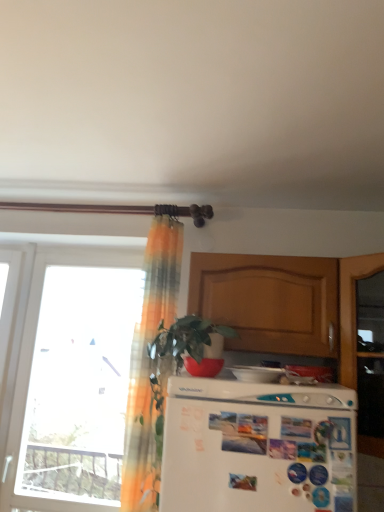
Question: Is white glossy refrigerator at center, which is the 1th appliance in left-to-right order, behind white glossy refrigerator at lower center, which appears as the first appliance when viewed from the back?

Choices:
 (A) no
 (B) yes

Answer: (A)

Question: Can you confirm if white glossy refrigerator at center, the first appliance from the front, is thinner than white glossy refrigerator at lower center, placed as the first appliance when sorted from right to left?

Choices:
 (A) no
 (B) yes

Answer: (A)

Question: From the image's perspective, is white glossy refrigerator at center, positioned as the second appliance in right-to-left order, below white glossy refrigerator at lower center, which appears as the first appliance when viewed from the back?

Choices:
 (A) yes
 (B) no

Answer: (B)

Question: Can you confirm if white glossy refrigerator at center, positioned as the second appliance in right-to-left order, is taller than white glossy refrigerator at lower center, which appears as the first appliance when viewed from the back?

Choices:
 (A) yes
 (B) no

Answer: (B)

Question: Is white glossy refrigerator at center, which is the 1th appliance in left-to-right order, oriented away from white glossy refrigerator at lower center, which is counted as the second appliance, starting from the front?

Choices:
 (A) no
 (B) yes

Answer: (A)

Question: Is there a large distance between white glossy refrigerator at center, arranged as the 2th appliance when viewed from the back, and white glossy refrigerator at lower center, which is counted as the second appliance, starting from the front?

Choices:
 (A) no
 (B) yes

Answer: (A)

Question: Is transparent glass window at left positioned in front of translucent orange curtain at upper left?

Choices:
 (A) no
 (B) yes

Answer: (A)

Question: Is transparent glass window at left smaller than translucent orange curtain at upper left?

Choices:
 (A) yes
 (B) no

Answer: (A)

Question: Is transparent glass window at left oriented away from translucent orange curtain at upper left?

Choices:
 (A) yes
 (B) no

Answer: (B)

Question: Is translucent orange curtain at upper left located within transparent glass window at left?

Choices:
 (A) yes
 (B) no

Answer: (B)

Question: Does transparent glass window at left appear on the right side of translucent orange curtain at upper left?

Choices:
 (A) no
 (B) yes

Answer: (A)

Question: Is transparent glass window at left aimed at translucent orange curtain at upper left?

Choices:
 (A) no
 (B) yes

Answer: (A)

Question: From a real-world perspective, is white glossy refrigerator at center, which is the 1th appliance in left-to-right order, under wooden cabinet at upper center?

Choices:
 (A) yes
 (B) no

Answer: (A)